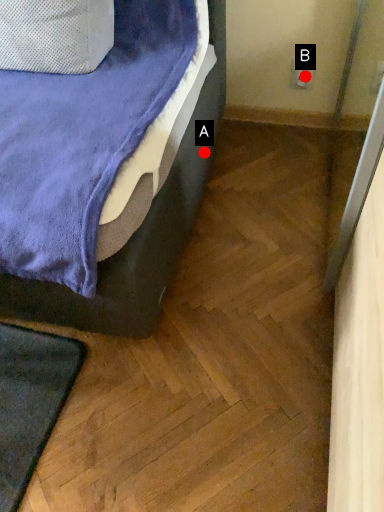
Question: Two points are circled on the image, labeled by A and B beside each circle. Which point appears closest to the camera in this image?

Choices:
 (A) A is closer
 (B) B is closer

Answer: (A)